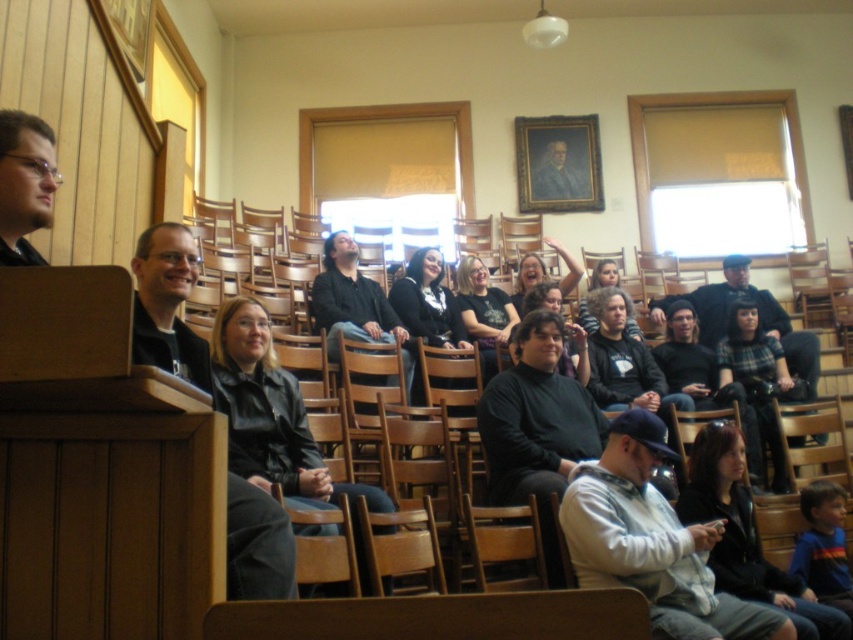
Who is lower down, light gray hoodie at center or dark gray knit sweater at center?

light gray hoodie at center is below.

Who is more forward, (605, 525) or (814, 394)?

Point (605, 525) is in front.

Is point (703, 624) behind point (775, 307)?

That is False.

Where is `light gray hoodie at center`? The image size is (853, 640). light gray hoodie at center is located at coordinates (653, 541).

Between point (13, 125) and point (758, 304), which one is positioned behind?

The point (758, 304) is behind.

Is point (15, 164) positioned after point (703, 304)?

No, it is not.

Locate an element on the screen. This screenshot has width=853, height=640. matte black jacket at left is located at coordinates (24, 184).

Can you confirm if black sweater at center is wider than dark gray sweater at center?

Yes.

From the picture: Measure the distance from black sweater at center to dark gray sweater at center.

They are 15.20 inches apart.

Where is `black sweater at center`? This screenshot has height=640, width=853. black sweater at center is located at coordinates (427, 301).

The width and height of the screenshot is (853, 640). I want to click on black sweater at center, so click(427, 301).